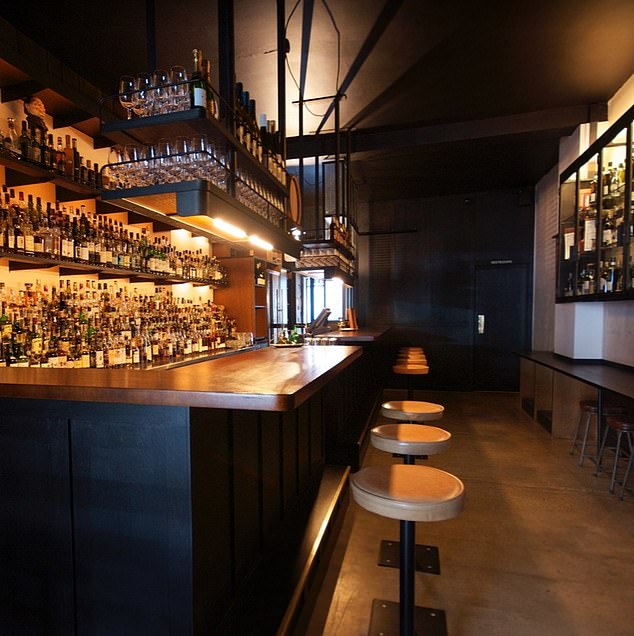
At what (x,y) coordinates should I click in order to perform the action: click on rows of wine. Please return your answer as a coordinate pair (x, y). Looking at the image, I should click on (248, 141), (340, 238).